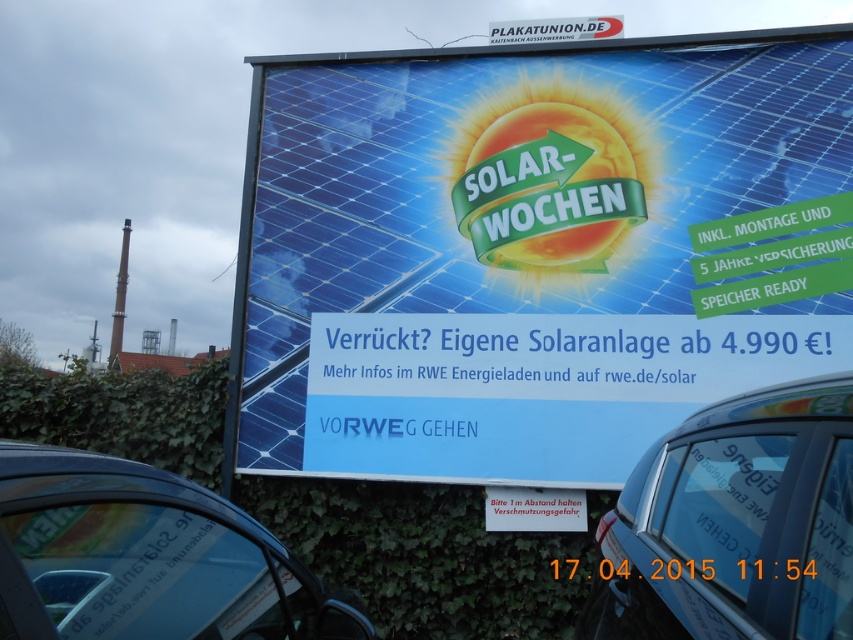
Question: Which object is the farthest from the blue metallic car at center?

Choices:
 (A) white plastic sign at top
 (B) metallic silver car at lower left
 (C) blue solar panel at center

Answer: (A)

Question: Can you confirm if metallic silver car at lower left is bigger than white plastic sign at lower center?

Choices:
 (A) no
 (B) yes

Answer: (B)

Question: Is blue solar panel at center further to camera compared to white plastic sign at lower center?

Choices:
 (A) no
 (B) yes

Answer: (A)

Question: Which is farther from the white plastic sign at top?

Choices:
 (A) white plastic sign at lower center
 (B) metallic silver car at lower left

Answer: (B)

Question: Which object appears farthest from the camera in this image?

Choices:
 (A) white plastic sign at top
 (B) white plastic sign at lower center
 (C) blue solar panel at center

Answer: (A)

Question: Can you confirm if metallic silver car at lower left is smaller than white plastic sign at lower center?

Choices:
 (A) yes
 (B) no

Answer: (B)